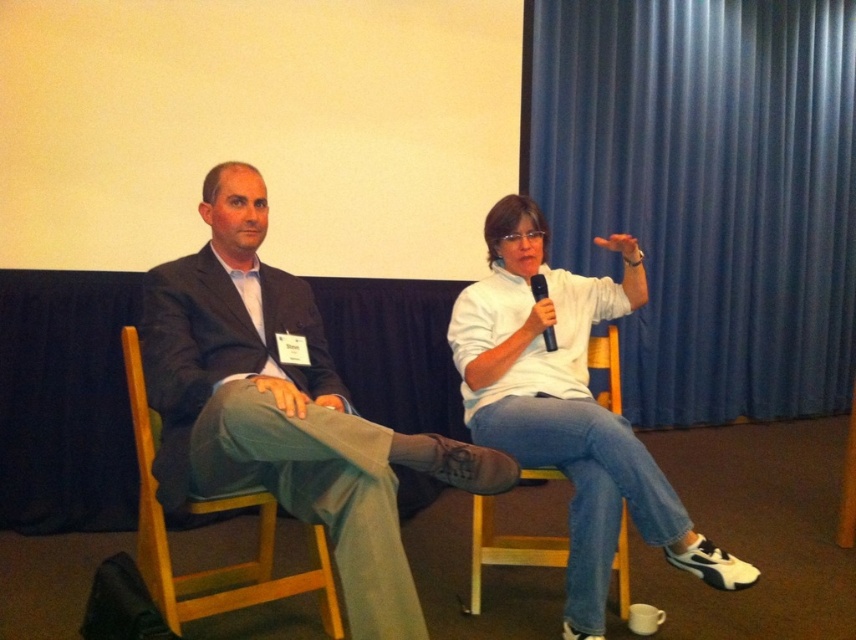
Does wooden chair at left come in front of black matte microphone at upper right?

Yes, wooden chair at left is closer to the viewer.

This screenshot has height=640, width=856. Describe the element at coordinates (205, 513) in the screenshot. I see `wooden chair at left` at that location.

The height and width of the screenshot is (640, 856). Identify the location of wooden chair at left. (205, 513).

In the scene shown: Which is more to the right, blue fabric curtain at upper right or white matte shirt at center?

blue fabric curtain at upper right

Describe the element at coordinates (706, 192) in the screenshot. I see `blue fabric curtain at upper right` at that location.

Locate an element on the screen. The height and width of the screenshot is (640, 856). blue fabric curtain at upper right is located at coordinates [x=706, y=192].

How much distance is there between blue fabric curtain at upper right and matte black suit at left?

They are 10.74 feet apart.

Can you confirm if blue fabric curtain at upper right is wider than matte black suit at left?

Correct, the width of blue fabric curtain at upper right exceeds that of matte black suit at left.

I want to click on blue fabric curtain at upper right, so click(x=706, y=192).